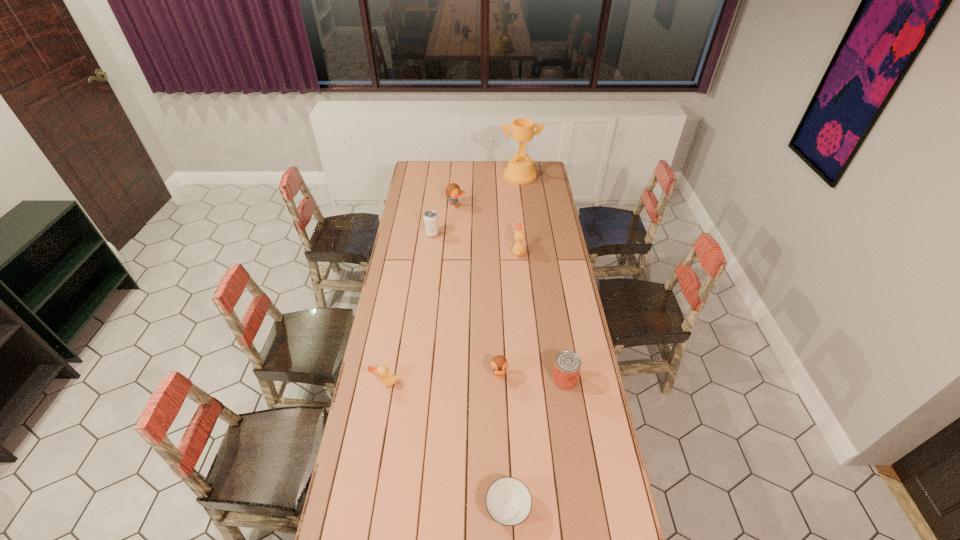
Identify the location of the fourth closest object relative to the leftmost duck. (518, 250).

The width and height of the screenshot is (960, 540). In order to click on object that ranks as the third closest to the can in this screenshot , I will do click(387, 379).

Where is `duck that is the nearest to the can`? The image size is (960, 540). duck that is the nearest to the can is located at coordinates (499, 364).

Locate which duck ranks third in proximity to the shortest object. Please provide its 2D coordinates. Your answer should be formatted as a tuple, i.e. [(x, y)], where the tuple contains the x and y coordinates of a point satisfying the conditions above.

[(518, 250)]

Find the location of a particular element. This screenshot has width=960, height=540. vacant space that satisfies the following two spatial constraints: 1. on the beak of the rightmost duck; 2. on the beak of the nearer tan duck is located at coordinates (531, 382).

Locate an element on the screen. The height and width of the screenshot is (540, 960). free location that satisfies the following two spatial constraints: 1. on the front-facing side of the farthest duck; 2. on the beak of the left tan duck is located at coordinates (444, 382).

This screenshot has width=960, height=540. Find the location of `vacant area that satisfies the following two spatial constraints: 1. on the front-facing side of the can; 2. on the left side of the second duck from right to left`. vacant area that satisfies the following two spatial constraints: 1. on the front-facing side of the can; 2. on the left side of the second duck from right to left is located at coordinates (499, 379).

The width and height of the screenshot is (960, 540). I want to click on free spot that satisfies the following two spatial constraints: 1. on the front-facing side of the smaller blue duck; 2. on the left side of the nearest object, so click(504, 510).